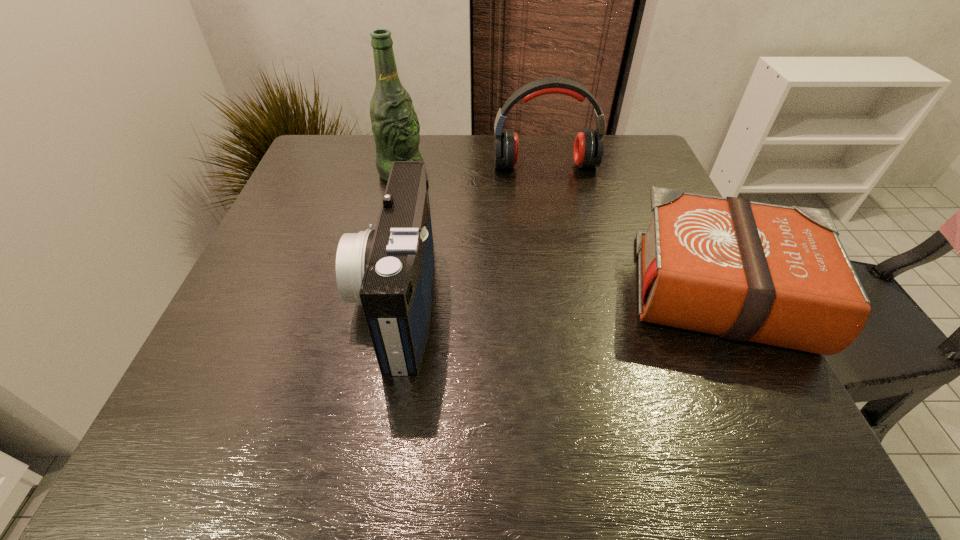
This screenshot has height=540, width=960. What are the coordinates of `camcorder` in the screenshot? It's located at (390, 270).

Where is `the shortest object`? This screenshot has height=540, width=960. the shortest object is located at coordinates (747, 271).

At what (x,y) coordinates should I click in order to perform the action: click on beer bottle. Please return your answer as a coordinate pair (x, y). The width and height of the screenshot is (960, 540). Looking at the image, I should click on (395, 126).

You are a GUI agent. You are given a task and a screenshot of the screen. Output one action in this format:
    pyautogui.click(x=<x>, y=<y>)
    Task: Click on the earphone
    Image resolution: width=960 pixels, height=540 pixels.
    Given the screenshot: What is the action you would take?
    pyautogui.click(x=588, y=148)

The height and width of the screenshot is (540, 960). Identify the location of free space located 0.060m on the lens of the camcorder. (x=324, y=299).

Identify the location of vacant space located 0.100m on the lens of the camcorder. (301, 299).

This screenshot has width=960, height=540. Identify the location of vacant space located on the lens of the camcorder. pos(270,299).

Identify the location of vacant space situated on the back of the Bible. click(657, 166).

Find the location of a particular element. free location located on the surface of the tallest object is located at coordinates (515, 241).

Where is `vacant position located 0.050m on the surface of the tallest object`? This screenshot has width=960, height=540. vacant position located 0.050m on the surface of the tallest object is located at coordinates click(430, 190).